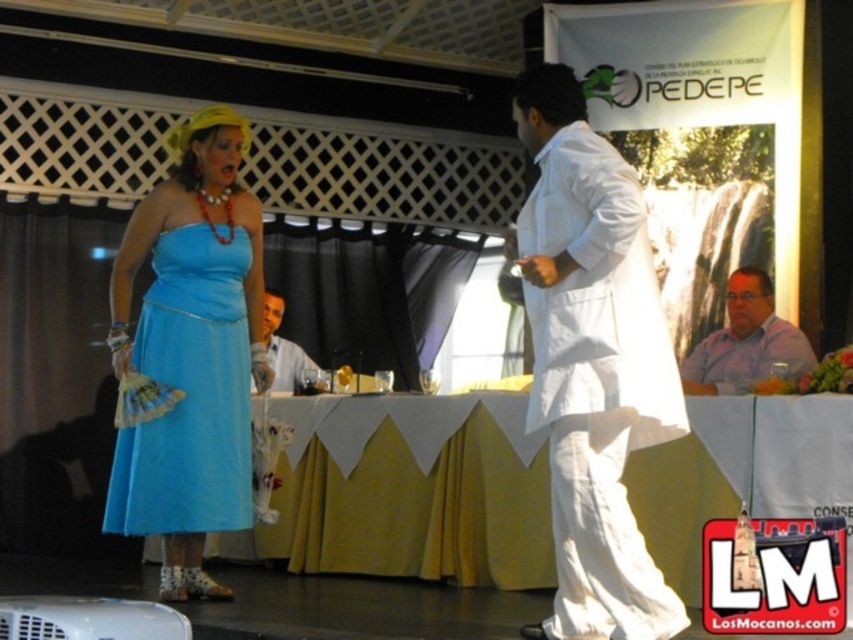
Is matte blue dress at center further to camera compared to purple shirt at center?

Yes, matte blue dress at center is behind purple shirt at center.

Which is more to the right, matte blue dress at center or purple shirt at center?

→ Positioned to the right is purple shirt at center.

This screenshot has height=640, width=853. Find the location of `matte blue dress at center`. matte blue dress at center is located at coordinates (189, 394).

Is white cotton robe at center above matte blue dress at center?

Correct, white cotton robe at center is located above matte blue dress at center.

From the picture: Who is more forward, (595, 588) or (167, 369)?

Point (595, 588)

Is point (618, 170) behind point (250, 458)?

No, it is in front of (250, 458).

Locate an element on the screen. Image resolution: width=853 pixels, height=640 pixels. white cotton robe at center is located at coordinates (596, 381).

Is purple shirt at center to the left of matte white shirt at center from the viewer's perspective?

Incorrect, purple shirt at center is not on the left side of matte white shirt at center.

Is point (688, 355) farther from viewer compared to point (274, 296)?

No, (688, 355) is closer to viewer.

This screenshot has height=640, width=853. In order to click on purple shirt at center in this screenshot , I will do `click(746, 340)`.